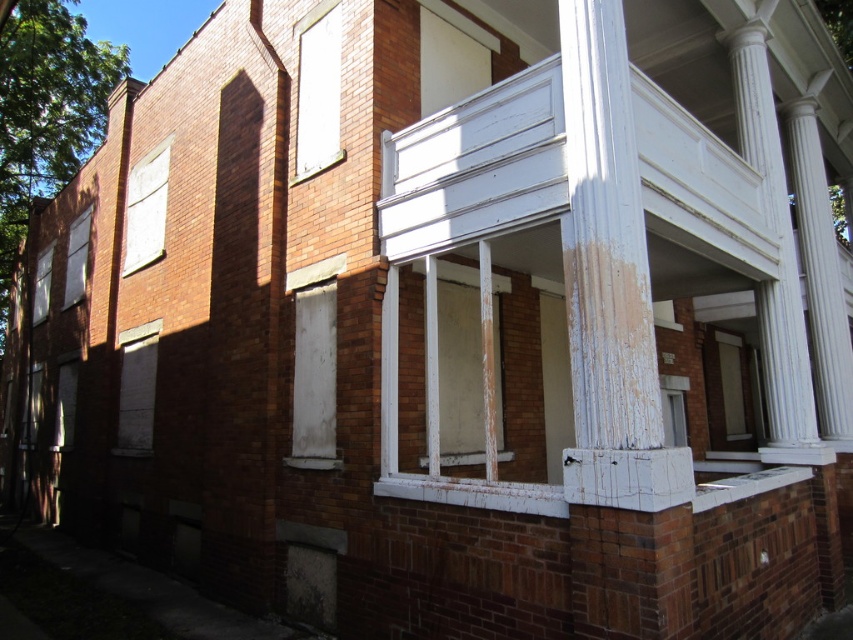
This screenshot has height=640, width=853. What do you see at coordinates (820, 275) in the screenshot? I see `white painted wood column at upper right` at bounding box center [820, 275].

Is white painted wood column at upper right taller than white matte window at upper center?

Yes.

At what (x,y) coordinates should I click in order to perform the action: click on white painted wood column at upper right. Please return your answer as a coordinate pair (x, y). This screenshot has width=853, height=640. Looking at the image, I should click on (820, 275).

Is white weathered column at upper center above white matte window at upper center?

Incorrect, white weathered column at upper center is not positioned above white matte window at upper center.

Which of these two, white weathered column at upper center or white matte window at upper center, stands taller?

Standing taller between the two is white weathered column at upper center.

Locate an element on the screen. The image size is (853, 640). white weathered column at upper center is located at coordinates (605, 237).

Does white painted wood at upper center have a lesser height compared to white matte sign at upper left?

Yes.

Between point (437, 54) and point (146, 168), which one is positioned behind?

The point (146, 168) is more distant.

Find the location of a particular element. The width and height of the screenshot is (853, 640). white painted wood at upper center is located at coordinates (451, 56).